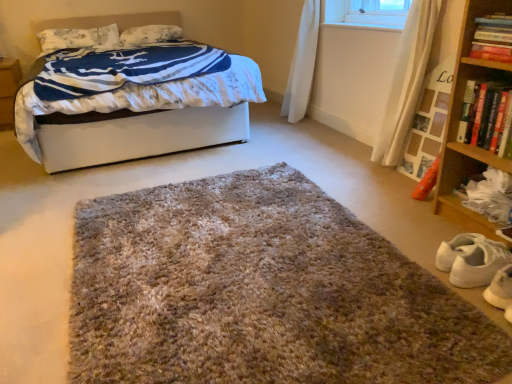
Question: From a real-world perspective, relative to wooden shelf at lower right, is white soft bed at upper left vertically above or below?

Choices:
 (A) below
 (B) above

Answer: (B)

Question: Does point click(210, 142) appear closer or farther from the camera than point click(460, 153)?

Choices:
 (A) closer
 (B) farther

Answer: (B)

Question: Which object is the farthest from the shaggy carpet at center?

Choices:
 (A) hardcover book at right, which is the 1th book in bottom-to-top order
 (B) white textured pillow at upper left, which ranks as the 1th pillow in right-to-left order
 (C) brown cardboard at left
 (D) white soft bed at upper left
 (E) hardcover book at upper right, the second book ordered from the bottom

Answer: (B)

Question: Which object is the farthest from the shaggy carpet at center?

Choices:
 (A) wooden bookshelf at right
 (B) white soft bed at upper left
 (C) hardcover book at upper right, the 1th book viewed from the top
 (D) brown cardboard at left
 (E) white floral fabric pillow at upper left, the 2th pillow viewed from the right

Answer: (E)